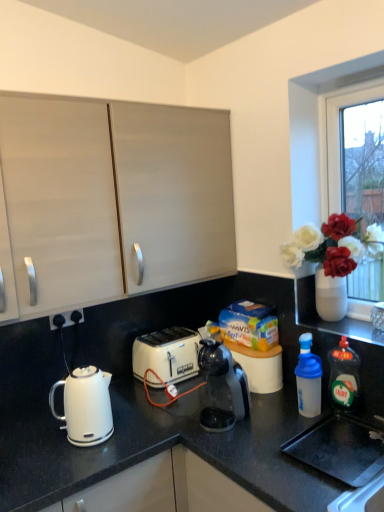
You are a GUI agent. You are given a task and a screenshot of the screen. Output one action in this format:
    pyautogui.click(x=<x>, y=<y>)
    Task: Click on the free location in front of white glossy kettle at left
    
    Given the screenshot: What is the action you would take?
    pyautogui.click(x=68, y=470)